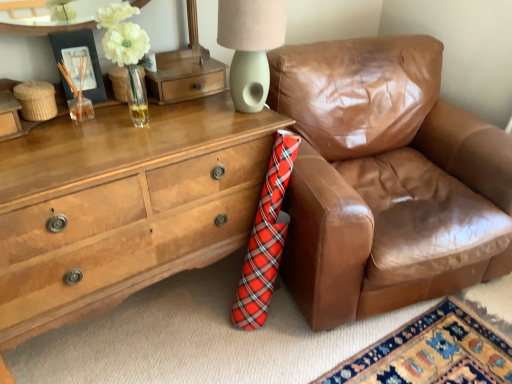
The image size is (512, 384). In order to click on blank area beneath matte green ceramic lampshade at upper center (from a real-world perspective) in this screenshot , I will do `click(244, 112)`.